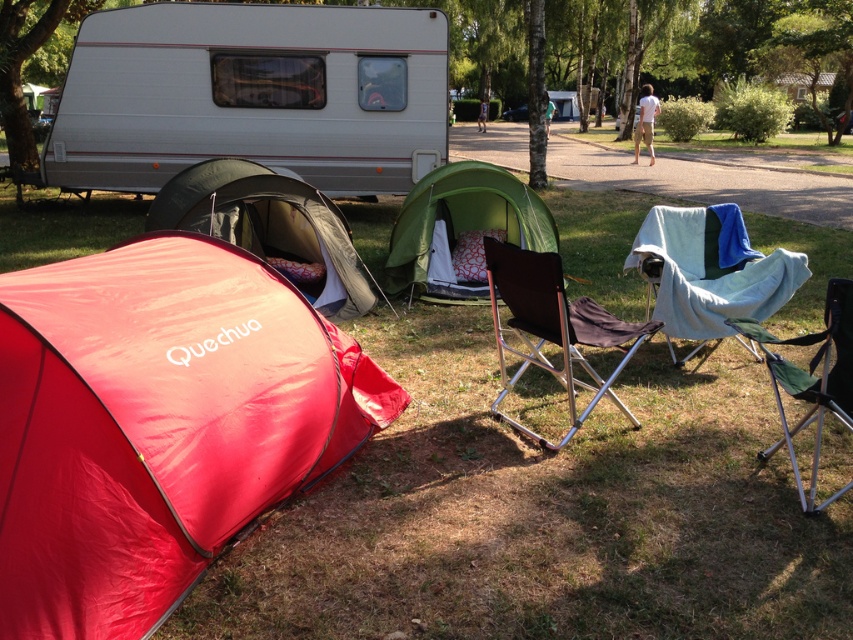
Which is above, blue fabric chair at center right or black metal folding chair at center?

blue fabric chair at center right is above.

Is blue fabric chair at center right smaller than black metal folding chair at center?

Yes, blue fabric chair at center right is smaller than black metal folding chair at center.

Identify the location of blue fabric chair at center right. (711, 272).

Between white glossy caravan at upper left and white cotton shirt at upper right, which one has less height?

white glossy caravan at upper left is shorter.

Which is above, white glossy caravan at upper left or white cotton shirt at upper right?

Positioned higher is white cotton shirt at upper right.

Identify the location of white glossy caravan at upper left. The height and width of the screenshot is (640, 853). (252, 96).

Which of these two, red nylon tent at lower left or green fabric chair at lower right, stands taller?

Standing taller between the two is red nylon tent at lower left.

Does point (201, 474) lie behind point (844, 365)?

No, it is not.

Find the location of a particular element. The image size is (853, 640). red nylon tent at lower left is located at coordinates (158, 424).